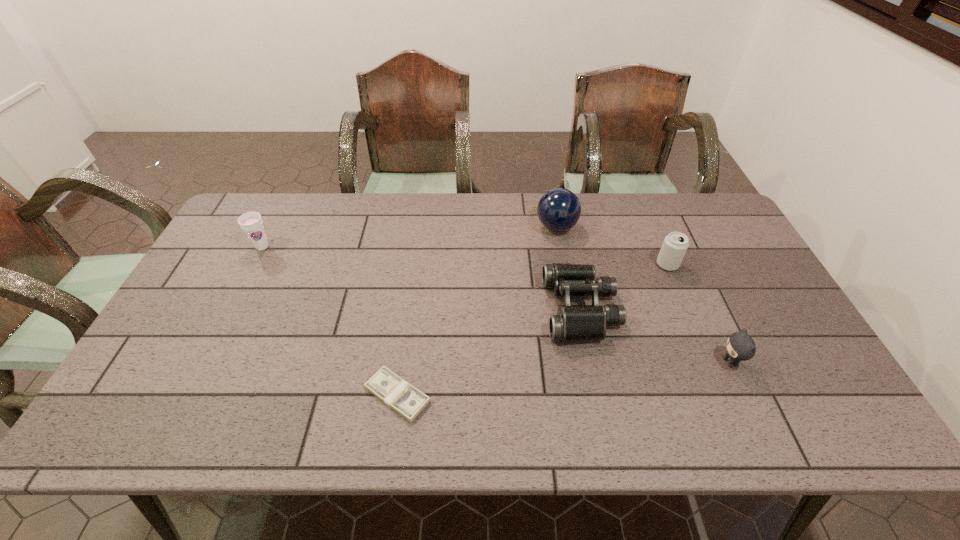
Locate an element on the screen. The image size is (960, 540). vacant space positioned on the right of the leftmost object is located at coordinates (311, 247).

Identify the location of blank space located 0.140m on the front of the can. Image resolution: width=960 pixels, height=540 pixels. (686, 309).

You are a GUI agent. You are given a task and a screenshot of the screen. Output one action in this format:
    pyautogui.click(x=<x>, y=<y>)
    Task: Click on the vacant area located on the front-facing side of the binoculars
    The height and width of the screenshot is (540, 960).
    Given the screenshot: What is the action you would take?
    pyautogui.click(x=444, y=309)

Locate an element on the screen. This screenshot has height=540, width=960. vacant space situated 0.260m on the front-facing side of the binoculars is located at coordinates (451, 309).

Identify the location of vacant area located 0.150m on the front-facing side of the binoculars. This screenshot has height=540, width=960. [492, 309].

Find the location of `vacant area situated on the front-facing side of the kitten`. vacant area situated on the front-facing side of the kitten is located at coordinates (574, 362).

This screenshot has width=960, height=540. Identify the location of vacant space situated on the front-facing side of the kitten. (570, 362).

Find the location of a particular element. The image size is (960, 540). vacant area situated on the front-facing side of the kitten is located at coordinates (611, 362).

This screenshot has width=960, height=540. What are the coordinates of `blank area located 0.150m on the back of the second object from left to right` in the screenshot? It's located at (408, 320).

I want to click on object located in the far edge section of the desktop, so click(x=559, y=209).